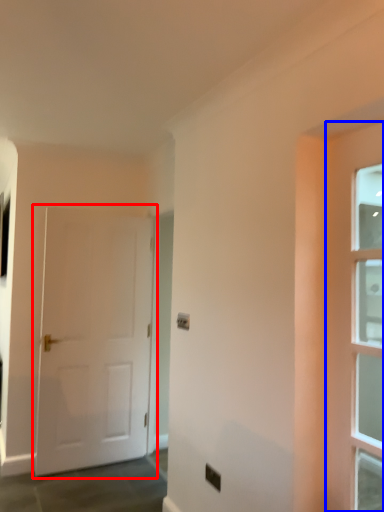
Question: Which point is further to the camera, door (highlighted by a red box) or door (highlighted by a blue box)?

Choices:
 (A) door
 (B) door

Answer: (A)